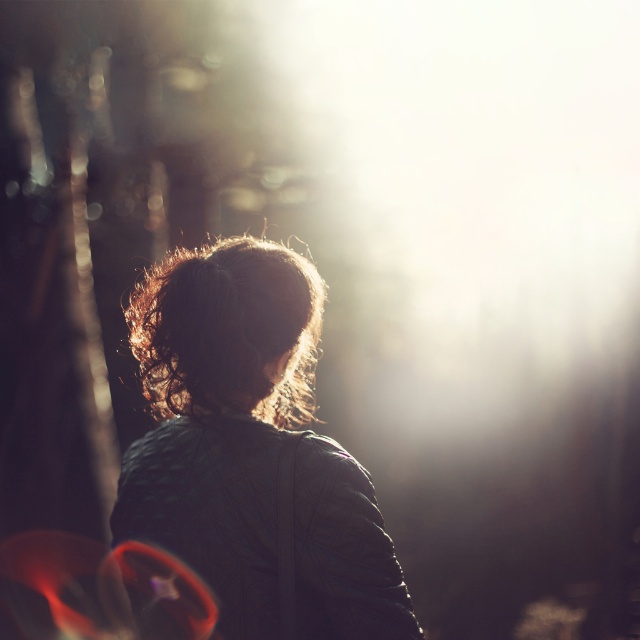
You are a photographer adjusting the lighting for a portrait. You notice the matte black jacket at center and curly brown hair at center in the frame. Which object should you adjust the light to highlight first if you want to ensure both are visible? Explain your reasoning.

The curly brown hair at center should be highlighted first because it is above the matte black jacket at center. Since the light source is in the upper right, adjusting the light for the higher object first will help balance the exposure between both elements.

You are a photographer analyzing the composition of this image. The matte black jacket at center and curly brown hair at center are both in focus. Which object occupies more horizontal space in the frame?

The matte black jacket at center has a greater width than the curly brown hair at center, so the matte black jacket at center occupies more horizontal space in the frame.

You are a photographer adjusting the focus on your camera. You want to ensure both the matte black jacket at center and the curly brown hair at center are in focus. Given that your camera can focus on objects within a 3.5 inch range, will both objects be in focus?

The matte black jacket at center and curly brown hair at center are 3.65 inches apart, which exceeds the camera focus range of 3.5 inches. Therefore, both objects cannot be in focus simultaneously.